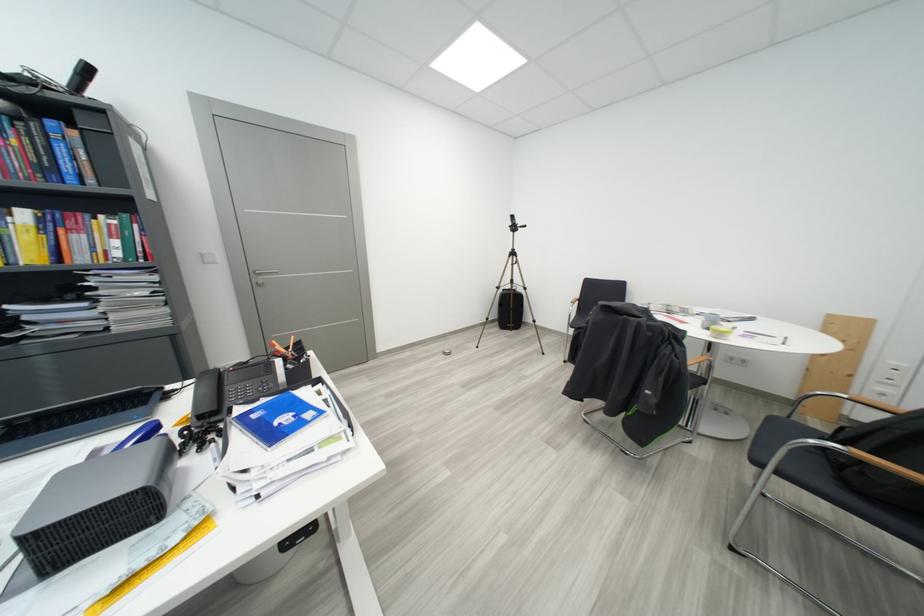
Identify the location of yellow hardcover book. The width and height of the screenshot is (924, 616). (27, 237).